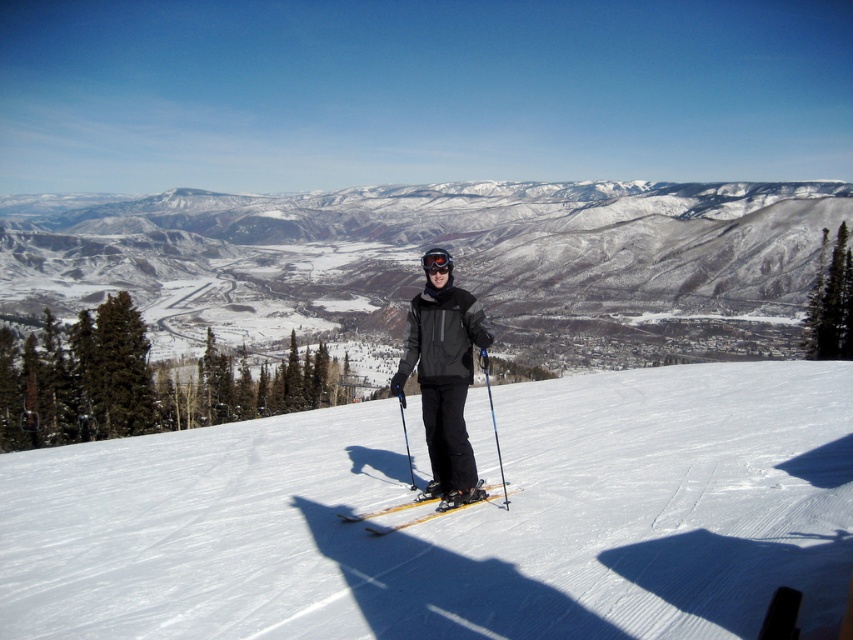
Who is lower down, black matte ski suit at center or blue plastic ski pole at center?

black matte ski suit at center is below.

Can you confirm if black matte ski suit at center is bigger than blue plastic ski pole at center?

Yes, black matte ski suit at center is bigger than blue plastic ski pole at center.

Is point (390, 380) more distant than point (508, 499)?

Yes, point (390, 380) is farther from viewer.

Find the location of a particular element. This screenshot has width=853, height=640. black matte ski suit at center is located at coordinates (444, 381).

Can you confirm if white snow at center is shorter than snowy mountain at center?

Yes, white snow at center is shorter than snowy mountain at center.

From the picture: How much distance is there between white snow at center and snowy mountain at center?

white snow at center and snowy mountain at center are 188.11 meters apart.

Locate an element on the screen. The height and width of the screenshot is (640, 853). white snow at center is located at coordinates (451, 518).

Where is `white snow at center`? The image size is (853, 640). white snow at center is located at coordinates (451, 518).

Which is above, white snow at center or black matte ski suit at center?

white snow at center

Between white snow at center and black matte ski suit at center, which one has less height?

white snow at center is shorter.

Describe the element at coordinates (451, 518) in the screenshot. I see `white snow at center` at that location.

Locate an element on the screen. white snow at center is located at coordinates (451, 518).